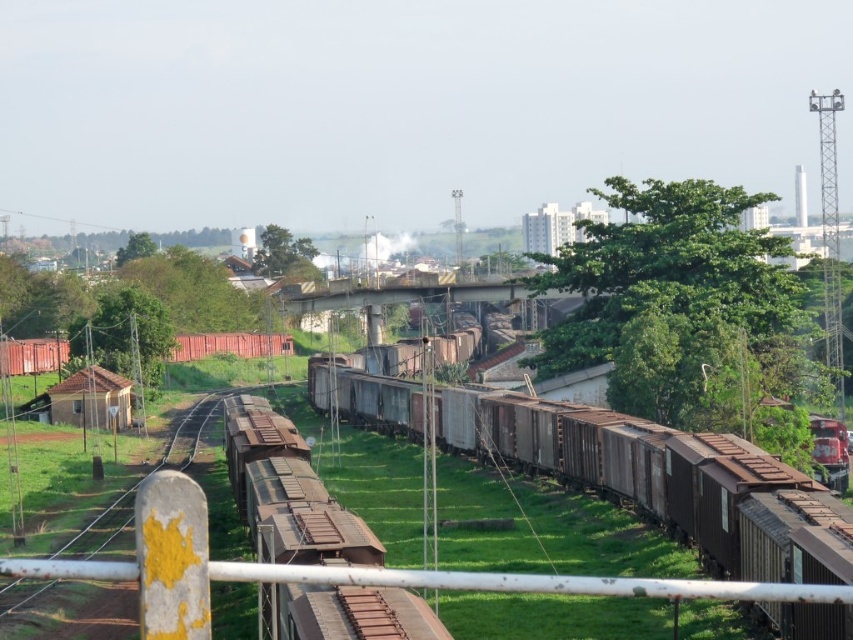
At what (x,y) coordinates should I click in order to perform the action: click on green leafy tree at upper center. Please return your answer as a coordinate pair (x, y). This screenshot has width=853, height=640. Looking at the image, I should click on (283, 253).

Is green leafy tree at upper center above green leafy tree at upper left?

No.

Who is more distant from viewer, (305, 243) or (135, 252)?

The point (305, 243) is behind.

Find the location of a particular element. green leafy tree at upper center is located at coordinates (283, 253).

Is rusty metal train car at center below green leafy tree at upper center?

Yes, rusty metal train car at center is below green leafy tree at upper center.

Is rusty metal train car at center to the left of green leafy tree at upper center from the viewer's perspective?

In fact, rusty metal train car at center is to the right of green leafy tree at upper center.

Which is in front, point (265, 419) or point (288, 269)?

Point (265, 419) is in front.

I want to click on rusty metal train car at center, so click(x=288, y=493).

Who is lower down, rusty metal train carriages at center or rusty metal train car at center?

rusty metal train car at center

Between point (660, 486) and point (258, 609), which one is positioned behind?

Point (660, 486)

Does point (345, 376) come in front of point (387, 618)?

That is False.

Find the location of `rusty metal train carriages at center`. rusty metal train carriages at center is located at coordinates (561, 444).